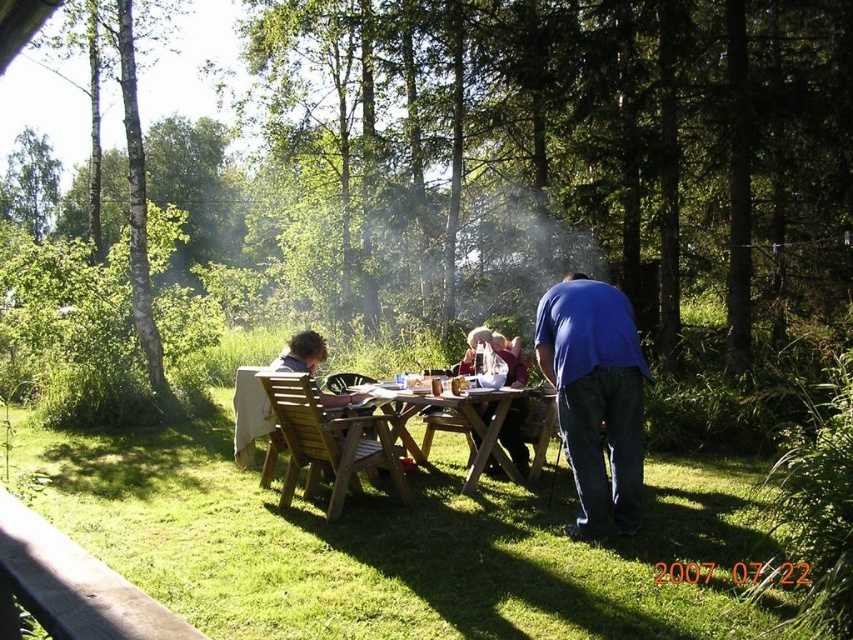
Question: Which object is the farthest from the wooden table at center?

Choices:
 (A) wooden picnic table at center
 (B) blue fabric shirt at right

Answer: (A)

Question: Which object appears closest to the camera in this image?

Choices:
 (A) blue fabric shirt at right
 (B) wooden picnic table at center
 (C) wooden table at center

Answer: (A)

Question: Is blue fabric shirt at right further to the viewer compared to wooden picnic table at center?

Choices:
 (A) no
 (B) yes

Answer: (A)

Question: Is wooden table at center further to the viewer compared to wooden picnic table at center?

Choices:
 (A) no
 (B) yes

Answer: (A)

Question: Which point is farther to the camera?

Choices:
 (A) wooden table at center
 (B) wooden picnic table at center

Answer: (B)

Question: Can you confirm if wooden table at center is positioned above wooden picnic table at center?

Choices:
 (A) no
 (B) yes

Answer: (B)